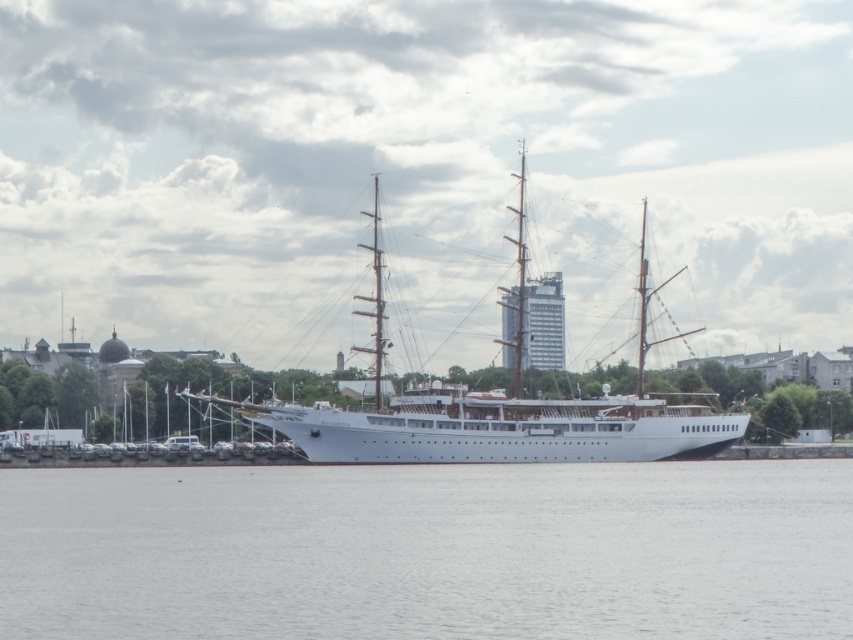
You are standing on the dock and looking at the clear water at lower center and the white matte ship at center. Which object appears taller from your perspective?

A: The white matte ship at center appears taller than the clear water at lower center because the clear water at lower center is shorter than the white matte ship at center.

You are a photographer planning to capture the waterfront scene. You want to ensure that the white matte ship at center is framed properly within the shot. Given the clear water at lower center, which object should you adjust your camera angle to focus on to ensure the ship remains centered and the water doesn?t dominate the lower part of the frame?

Since the clear water at lower center is wider than the white matte ship at center, you should adjust your camera angle to focus on the white matte ship at center to keep it centered and prevent the wider water area from taking over the lower part of the frame.